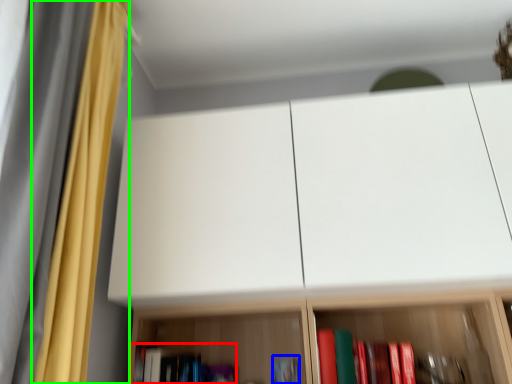
Question: Estimate the real-world distances between objects in this image. Which object is closer to book (highlighted by a red box), book (highlighted by a blue box) or curtain (highlighted by a green box)?

Choices:
 (A) book
 (B) curtain

Answer: (A)